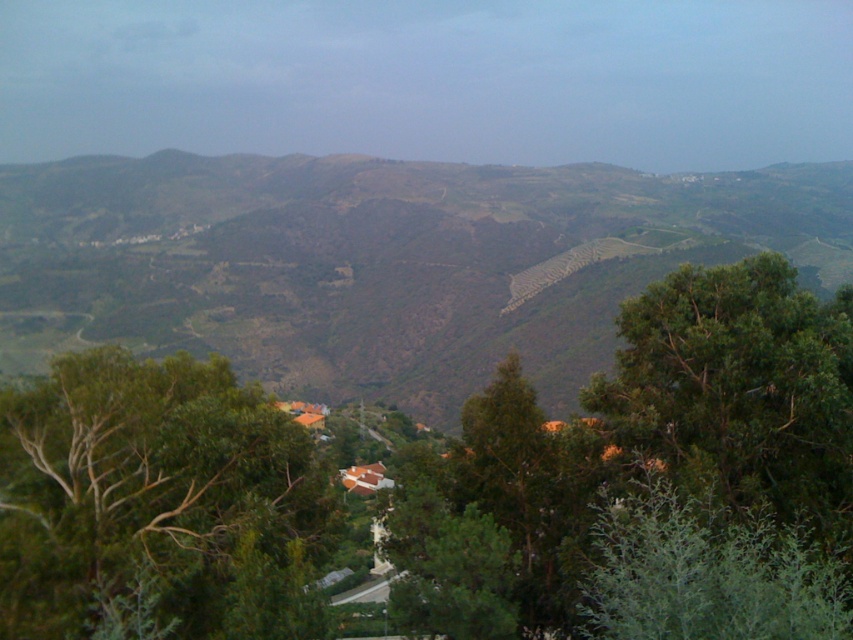
You are standing at the base of the green grassy hillside at center and want to walk to the green leafy tree at lower left. Which direction should you head to reach the tree?

The green grassy hillside at center is positioned over the green leafy tree at lower left, so you should head downward to reach the tree.